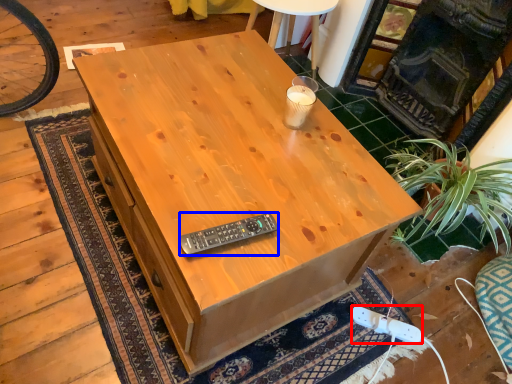
Question: Which of the following is the farthest to the observer, plug (highlighted by a red box) or control (highlighted by a blue box)?

Choices:
 (A) plug
 (B) control

Answer: (A)